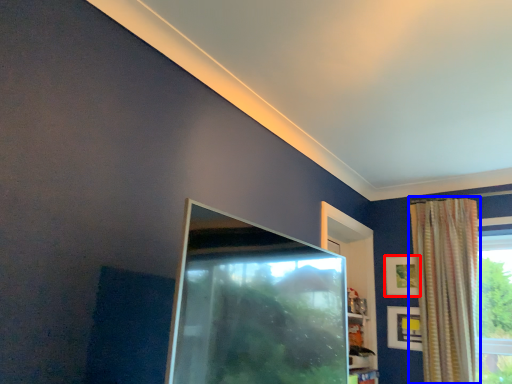
Question: Which of the following is the farthest to the observer, picture frame (highlighted by a red box) or curtain (highlighted by a blue box)?

Choices:
 (A) picture frame
 (B) curtain

Answer: (A)